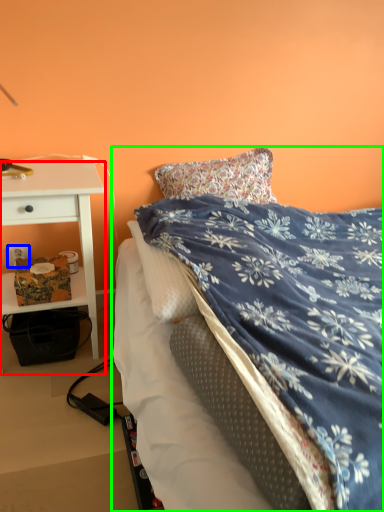
Question: Which object is positioned closest to desk (highlighted by a red box)? Select from power outlet (highlighted by a blue box) and bed (highlighted by a green box).

Choices:
 (A) power outlet
 (B) bed

Answer: (A)